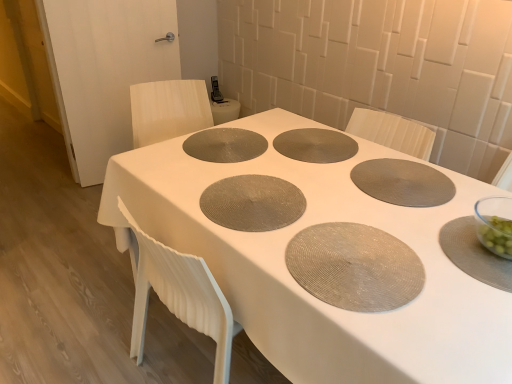
Where is `vacant space underneath matte gray placemat at center, the second oval in the bottom-to-top sequence (from a real-world perspective)`? The width and height of the screenshot is (512, 384). vacant space underneath matte gray placemat at center, the second oval in the bottom-to-top sequence (from a real-world perspective) is located at coordinates (223, 139).